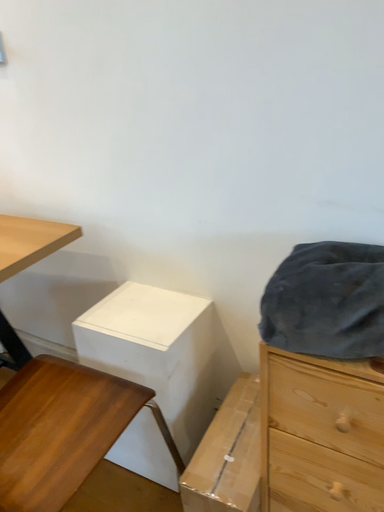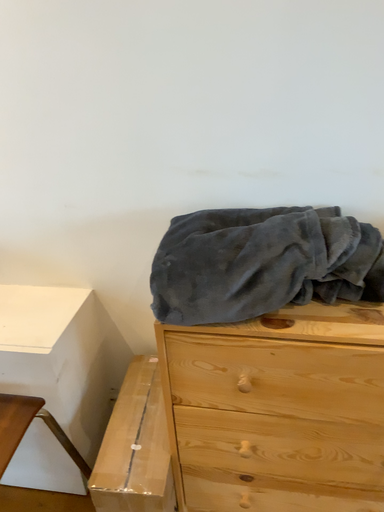
Question: How did the camera likely rotate when shooting the video?

Choices:
 (A) rotated left
 (B) rotated right

Answer: (B)